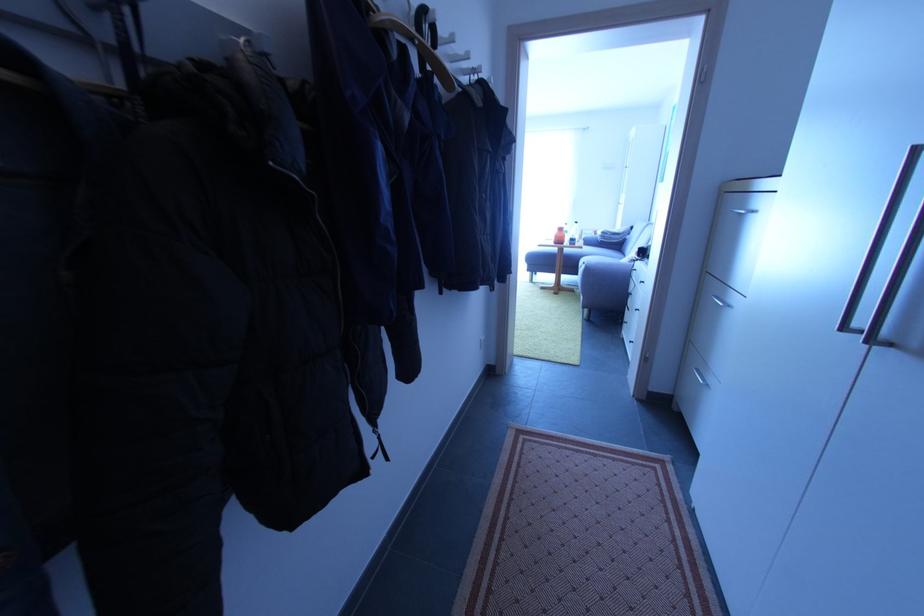
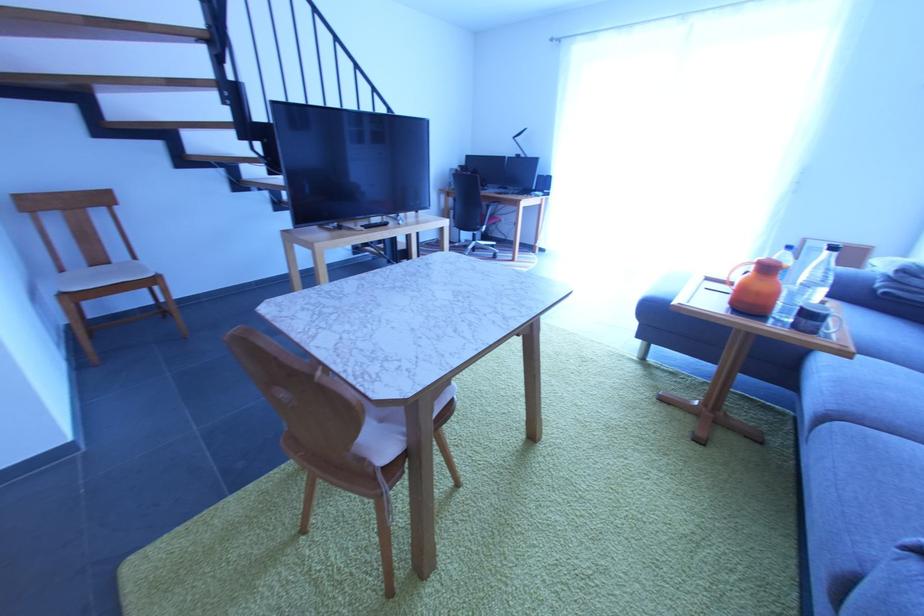
Locate, in the second image, the point that corresponds to point 568,238 in the first image.

(779, 297)